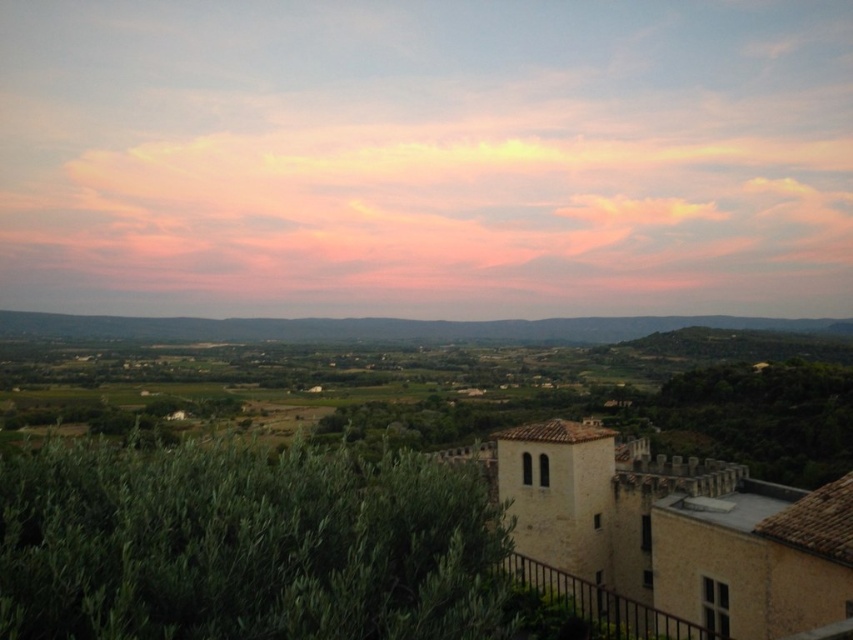
Question: Which point is closer to the camera taking this photo?

Choices:
 (A) [33, 609]
 (B) [498, 342]

Answer: (A)

Question: Does green leafy bush at lower left appear over gray/neutral horizon at center?

Choices:
 (A) no
 (B) yes

Answer: (A)

Question: Is green leafy bush at lower left positioned at the back of gray/neutral horizon at center?

Choices:
 (A) no
 (B) yes

Answer: (A)

Question: Is green leafy bush at lower left in front of gray/neutral horizon at center?

Choices:
 (A) no
 (B) yes

Answer: (B)

Question: Which point is farther to the camera?

Choices:
 (A) gray/neutral horizon at center
 (B) green leafy bush at lower left

Answer: (A)